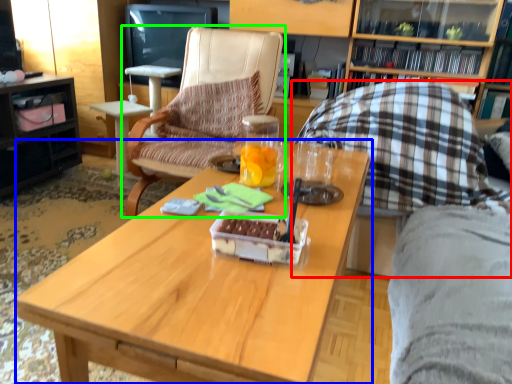
Question: Considering the real-world distances, which object is farthest from chair (highlighted by a red box)? coffee table (highlighted by a blue box) or chair (highlighted by a green box)?

Choices:
 (A) coffee table
 (B) chair

Answer: (B)